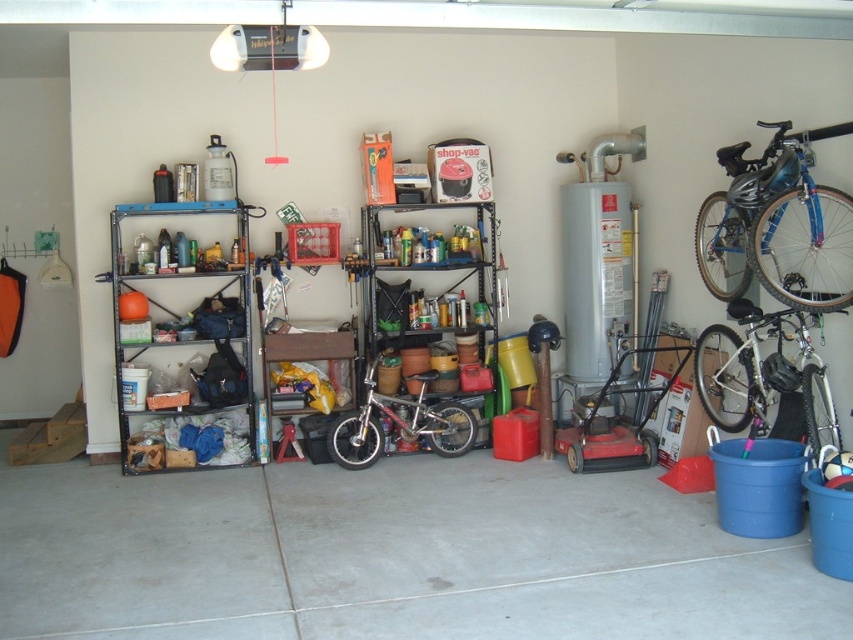
Question: Which point is closer to the camera?

Choices:
 (A) blue metallic bicycle at upper right
 (B) metallic gray shelf at left

Answer: (A)

Question: From the image, what is the correct spatial relationship of metallic gray shelf at left in relation to blue metallic bicycle at upper right?

Choices:
 (A) left
 (B) right

Answer: (A)

Question: Is silver metallic bicycle at center to the left of wooden workbench at center from the viewer's perspective?

Choices:
 (A) yes
 (B) no

Answer: (B)

Question: Estimate the real-world distances between objects in this image. Which object is closer to the wooden workbench at center?

Choices:
 (A) blue metallic bicycle at upper right
 (B) metallic gray shelf at left
 (C) silver metallic bicycle at center
 (D) metallic silver shelves at center

Answer: (C)

Question: Is metallic gray shelf at left thinner than blue metallic bicycle at upper right?

Choices:
 (A) yes
 (B) no

Answer: (B)

Question: Which point is farther to the camera?

Choices:
 (A) silver metallic bicycle at center
 (B) metallic silver shelves at center
 (C) metallic gray shelf at left
 (D) shiny silver bicycle at right

Answer: (B)